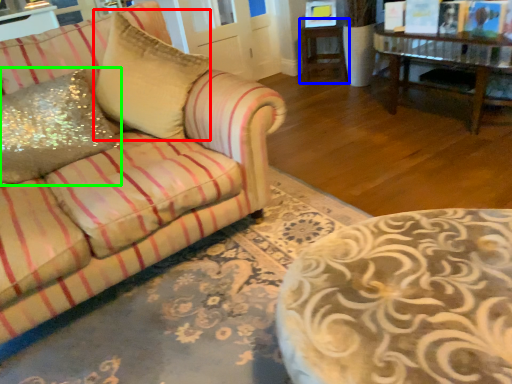
Question: Estimate the real-world distances between objects in this image. Which object is farther from throw pillow (highlighted by a red box), side table (highlighted by a blue box) or throw pillow (highlighted by a green box)?

Choices:
 (A) side table
 (B) throw pillow

Answer: (A)